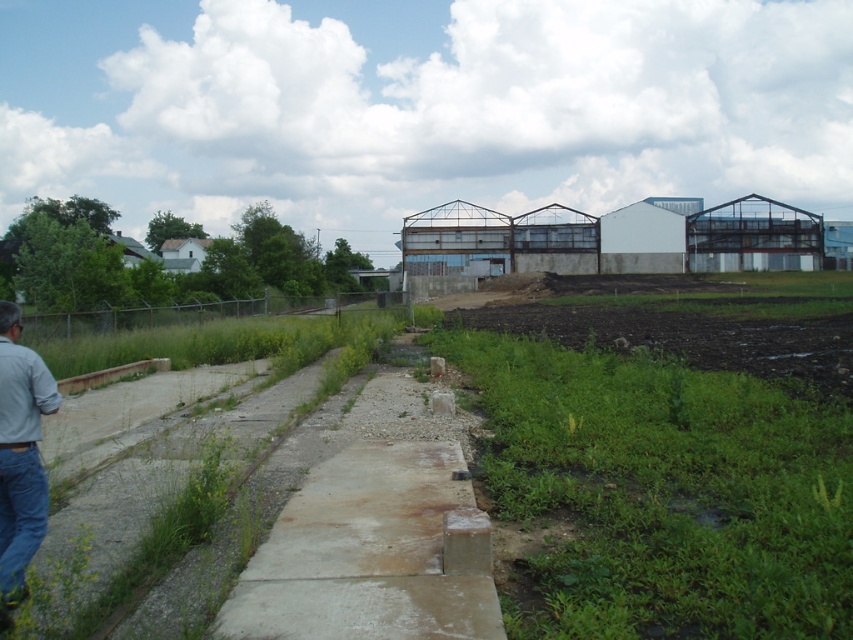
You are a delivery person carrying a package and need to cross from the concrete at center to the denim at left. The path between them is 6.82 feet. If your delivery cart is 3 feet wide, can you safely navigate the space between them?

The concrete at center is 6.82 feet from the denim at left. Since the cart is 3 feet wide, there is enough space to safely navigate between them as the distance is greater than the cart width.

You are standing on the concrete at center and want to move to the blue denim jeans at lower left. Which direction should you move to reach them?

The concrete at center is below the blue denim jeans at lower left, so you should move upward to reach them.